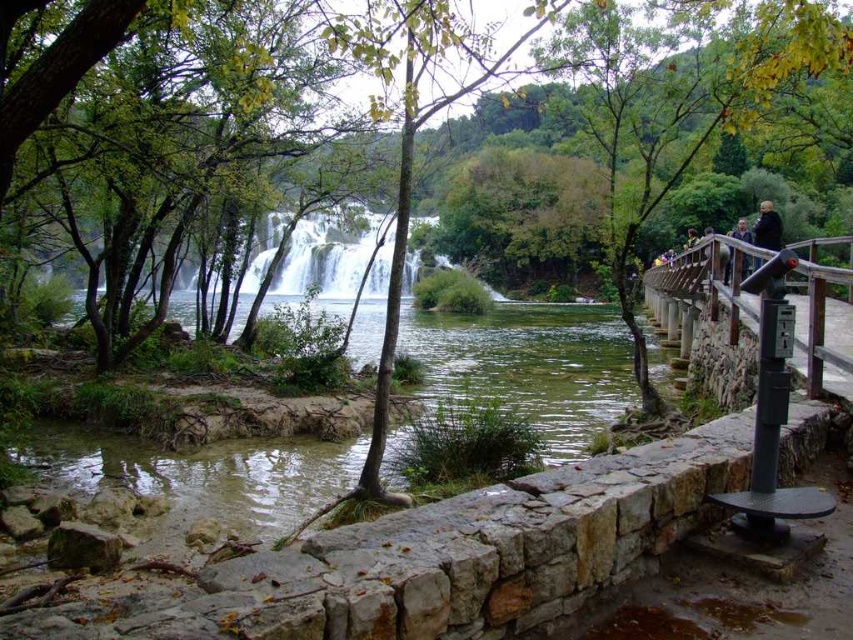
The image size is (853, 640). What do you see at coordinates (335, 257) in the screenshot?
I see `white frothy water at center` at bounding box center [335, 257].

How distant is white frothy water at center from dark brown leather jacket at upper right?

The distance of white frothy water at center from dark brown leather jacket at upper right is 31.50 meters.

Where is `white frothy water at center`? This screenshot has height=640, width=853. white frothy water at center is located at coordinates (335, 257).

Can you confirm if clear water at center is positioned below white frothy water at center?

Yes.

Who is more distant from viewer, (x=616, y=397) or (x=318, y=259)?

Positioned behind is point (x=318, y=259).

Is point (258, 464) behind point (341, 227)?

No, it is in front of (341, 227).

I want to click on clear water at center, so (x=529, y=365).

Which is more to the left, golden hair at upper right or dark brown leather jacket at upper right?

dark brown leather jacket at upper right

Between golden hair at upper right and dark brown leather jacket at upper right, which one has less height?

dark brown leather jacket at upper right

The width and height of the screenshot is (853, 640). What do you see at coordinates (767, 227) in the screenshot? I see `golden hair at upper right` at bounding box center [767, 227].

Image resolution: width=853 pixels, height=640 pixels. Find the location of `golden hair at upper right`. golden hair at upper right is located at coordinates (767, 227).